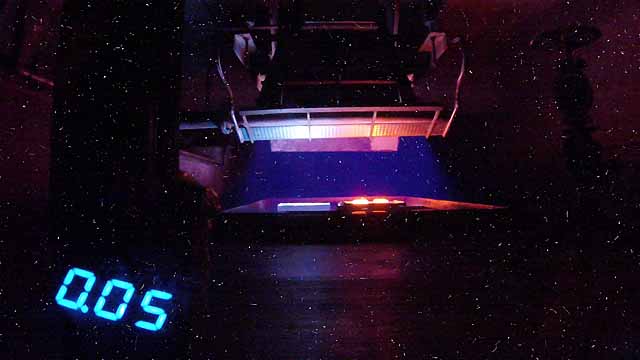
You are a GUI agent. You are given a task and a screenshot of the screen. Output one action in this format:
    pyautogui.click(x=<x>, y=<y>)
    Task: Click on the table
    
    Given the screenshot: What is the action you would take?
    pyautogui.click(x=346, y=178)